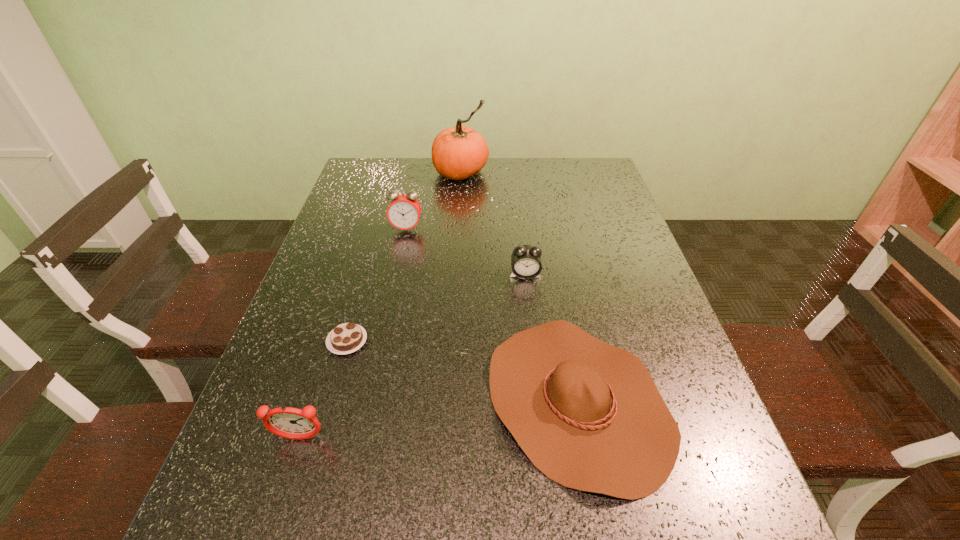
Identify the location of unoccupied position between the farthest object and the rightmost alarm clock. The width and height of the screenshot is (960, 540). (492, 224).

This screenshot has height=540, width=960. I want to click on vacant space that's between the farthest alarm clock and the farthest object, so click(434, 201).

Where is `vacant region between the second farthest alarm clock and the farthest object`? This screenshot has height=540, width=960. vacant region between the second farthest alarm clock and the farthest object is located at coordinates (492, 224).

Locate an element on the screen. This screenshot has height=540, width=960. the second closest object to the pumpkin is located at coordinates (526, 263).

Select which object appears as the fourth closest to the second tallest object. Please provide its 2D coordinates. Your answer should be formatted as a tuple, i.e. [(x, y)], where the tuple contains the x and y coordinates of a point satisfying the conditions above.

[(588, 415)]

You are a GUI agent. You are given a task and a screenshot of the screen. Output one action in this format:
    pyautogui.click(x=<x>, y=<y>)
    Task: Click on the alarm clock that is the closest to the nearest alarm clock
    
    Given the screenshot: What is the action you would take?
    pyautogui.click(x=526, y=263)

Image resolution: width=960 pixels, height=540 pixels. In order to click on the closest alarm clock to the second shortest object in this screenshot , I will do `click(526, 263)`.

Locate an element on the screen. Image resolution: width=960 pixels, height=540 pixels. blank area in the image that satisfies the following two spatial constraints: 1. on the front side of the rightmost alarm clock; 2. on the right side of the cowboy hat is located at coordinates (540, 400).